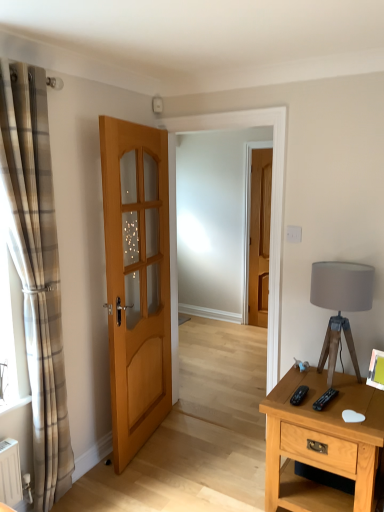
Locate an element on the screen. vacant area that lies to the right of light brown wooden door at center, the first door viewed from the left is located at coordinates coord(200,446).